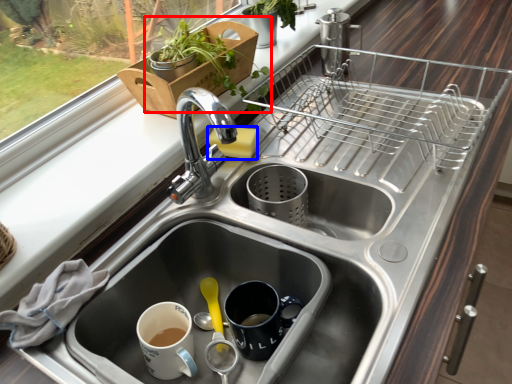
Question: Among these objects, which one is nearest to the camera, houseplant (highlighted by a red box) or soap (highlighted by a blue box)?

Choices:
 (A) houseplant
 (B) soap

Answer: (A)